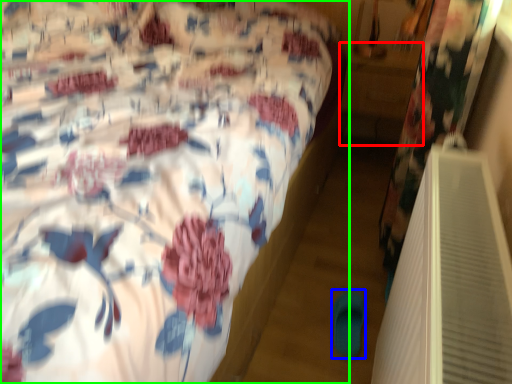
Question: Considering the real-world distances, which object is closest to table (highlighted by a red box)? slipper (highlighted by a blue box) or bed (highlighted by a green box).

Choices:
 (A) slipper
 (B) bed

Answer: (B)